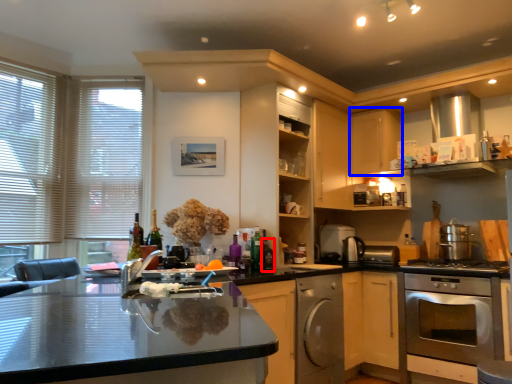
Question: Which object is further to the camera taking this photo, bottle (highlighted by a red box) or cabinetry (highlighted by a blue box)?

Choices:
 (A) bottle
 (B) cabinetry

Answer: (B)